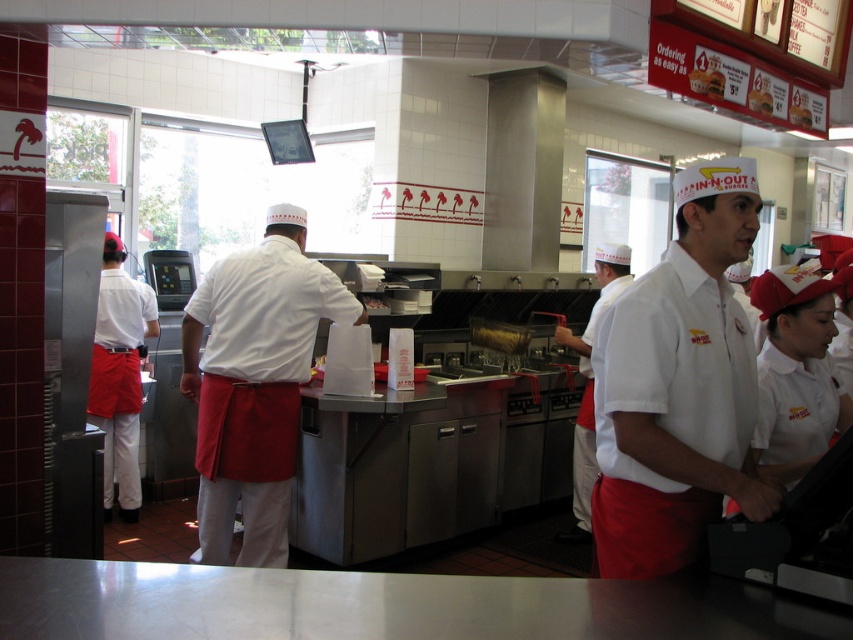
You are a delivery person standing at the entrance of the In N Out Burger kitchen. You need to place a package at point (675,321). The package is 1.5 meters wide. Will it fit in the space at that point?

The distance of point (675,321) from camera is 1.81 meters. Since the package is 1.5 meters wide, it will fit as the distance is greater than the package width.

You are a new employee at InN Out Burger and need to find the white matte apron at center to start your shift. Based on the coordinates provided, where should you look in the kitchen?

The white matte apron at center is located at point (x=254, y=381), which means it is positioned near the central area of the kitchen.

You are a customer who just entered the In N Out Burger kitchen. You notice two aprons hanging on hooks near the entrance. The white matte apron at center and the matte red apron at left. Which apron is bigger in size?

The white matte apron at center is larger in size compared to the matte red apron at left.